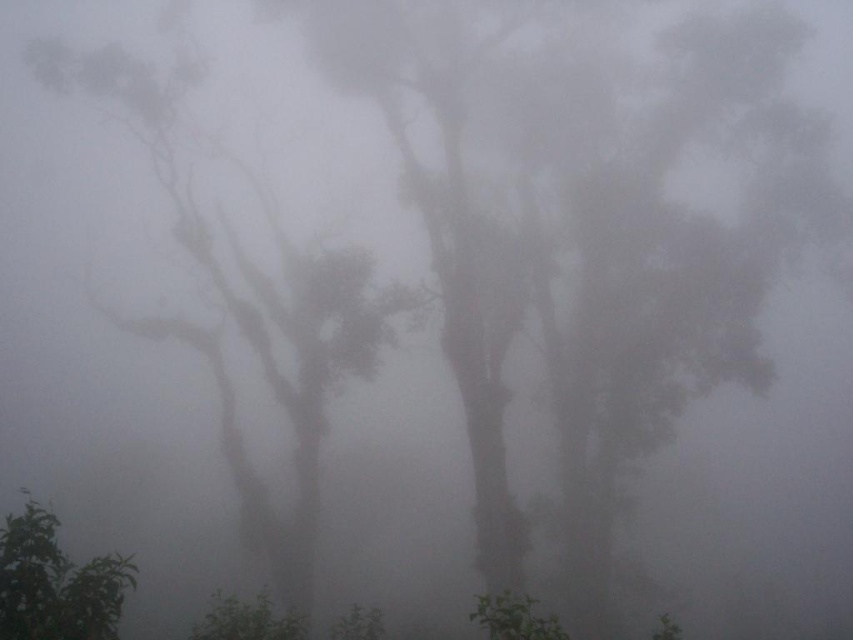
Question: Which point is farther from the camera taking this photo?

Choices:
 (A) (113, 611)
 (B) (306, 538)

Answer: (B)

Question: Which object appears closest to the camera in this image?

Choices:
 (A) foggy translucent tree at left
 (B) green leafy tree at lower left

Answer: (B)

Question: Can you confirm if foggy translucent tree at left is wider than green leafy tree at lower left?

Choices:
 (A) no
 (B) yes

Answer: (B)

Question: Can you confirm if foggy translucent tree at left is bigger than green leafy tree at lower left?

Choices:
 (A) no
 (B) yes

Answer: (B)

Question: Among these objects, which one is farthest from the camera?

Choices:
 (A) foggy translucent tree at left
 (B) green leafy tree at lower left

Answer: (A)

Question: Can you confirm if foggy translucent tree at left is smaller than green leafy tree at lower left?

Choices:
 (A) yes
 (B) no

Answer: (B)